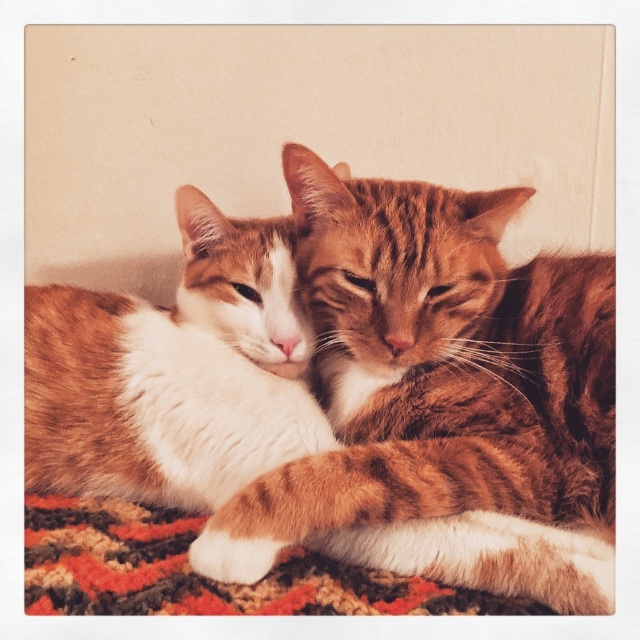
Describe the element at coordinates (173, 372) in the screenshot. The width and height of the screenshot is (640, 640). I see `white fur cat at center` at that location.

Does white fur cat at center have a greater height compared to carpeted mat at lower center?

Indeed, white fur cat at center has a greater height compared to carpeted mat at lower center.

You are a GUI agent. You are given a task and a screenshot of the screen. Output one action in this format:
    pyautogui.click(x=<x>, y=<y>)
    Task: Click on the white fur cat at center
    
    Given the screenshot: What is the action you would take?
    pyautogui.click(x=173, y=372)

Can you confirm if orange tabby cat at center is bigger than carpeted mat at lower center?

Correct, orange tabby cat at center is larger in size than carpeted mat at lower center.

Does orange tabby cat at center appear on the right side of carpeted mat at lower center?

Yes, orange tabby cat at center is to the right of carpeted mat at lower center.

Between point (561, 260) and point (440, 589), which one is positioned behind?

The point (561, 260) is behind.

Where is `orange tabby cat at center`? orange tabby cat at center is located at coordinates (433, 371).

Does orange tabby cat at center have a larger size compared to white fur cat at center?

Correct, orange tabby cat at center is larger in size than white fur cat at center.

Where is `orange tabby cat at center`? The width and height of the screenshot is (640, 640). orange tabby cat at center is located at coordinates (433, 371).

The height and width of the screenshot is (640, 640). I want to click on orange tabby cat at center, so click(433, 371).